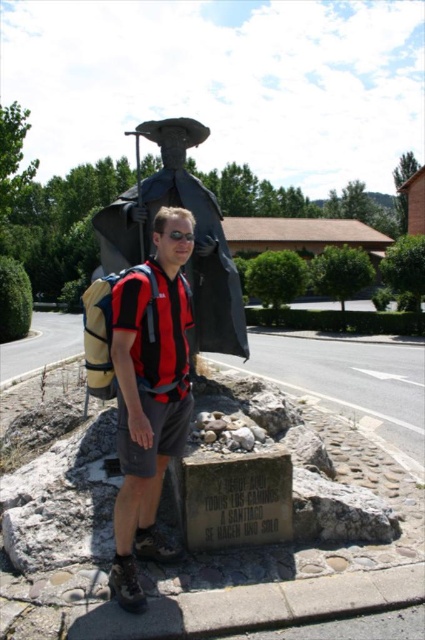
Question: Does red and black striped shirt at center have a greater width compared to black plastic goggles at center?

Choices:
 (A) yes
 (B) no

Answer: (A)

Question: Which point is farther to the camera?

Choices:
 (A) black matte statue at upper center
 (B) red and black striped shirt at center

Answer: (A)

Question: Where is red and black striped shirt at center located in relation to black plastic goggles at center in the image?

Choices:
 (A) above
 (B) below

Answer: (B)

Question: Based on their relative distances, which object is farther from the black matte statue at upper center?

Choices:
 (A) black plastic goggles at center
 (B) red and black striped shirt at center

Answer: (A)

Question: Does red and black striped shirt at center have a lesser width compared to black plastic goggles at center?

Choices:
 (A) yes
 (B) no

Answer: (B)

Question: Which object is closer to the camera taking this photo?

Choices:
 (A) black plastic goggles at center
 (B) black matte statue at upper center

Answer: (A)